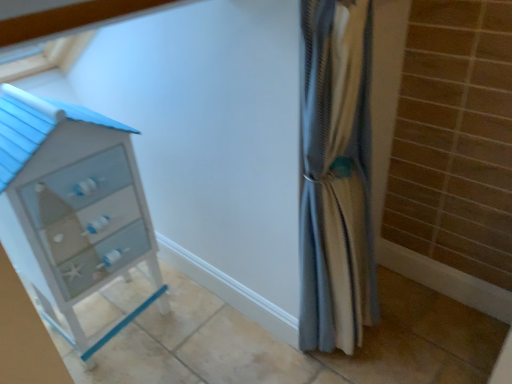
This screenshot has height=384, width=512. Identify the location of matte blue wood chest of drawers at left. (72, 207).

What do you see at coordinates (72, 207) in the screenshot? I see `matte blue wood chest of drawers at left` at bounding box center [72, 207].

Identify the location of matte blue wood chest of drawers at left. The width and height of the screenshot is (512, 384). (72, 207).